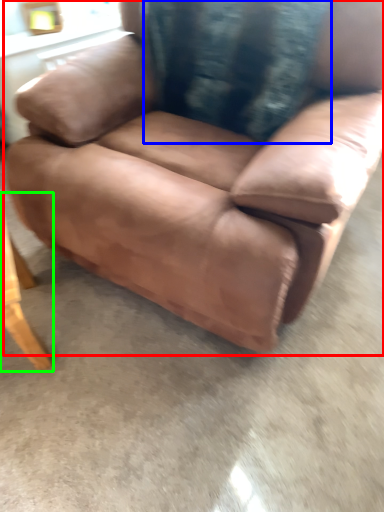
Question: Which object is positioned farthest from chair (highlighted by a red box)? Select from pillow (highlighted by a blue box) and table (highlighted by a green box).

Choices:
 (A) pillow
 (B) table

Answer: (B)